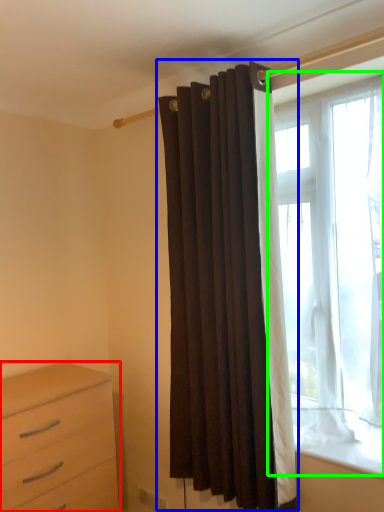
Question: Estimate the real-world distances between objects in this image. Which object is farther from chest of drawers (highlighted by a red box), curtain (highlighted by a blue box) or window (highlighted by a green box)?

Choices:
 (A) curtain
 (B) window

Answer: (B)